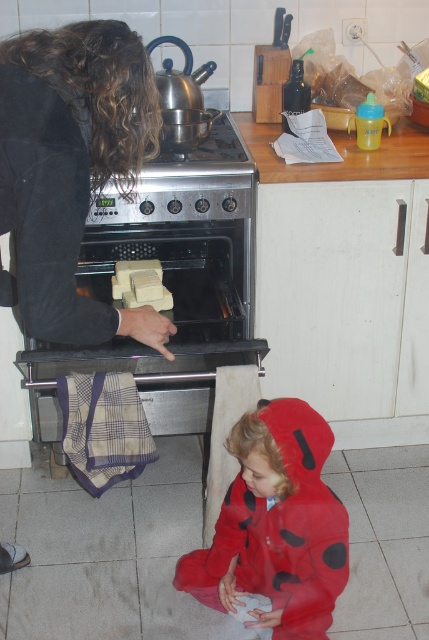
You are a delivery robot with a height of 1.5 meters. You need to deliver a package to the stainless steel oven at center. The package is 1.6 meters tall. Will the package fit inside the oven?

The stainless steel oven at center and viewer are 1.81 meters apart. The height of the package is 1.6 meters, which is less than the distance between the oven and the viewer. Therefore, the package will fit inside the oven.

You are a home chef preparing a meal and need to check the height of the red fuzzy coat at lower center and the yellow soft cheese at oven center. Which object is taller?

The red fuzzy coat at lower center is taller than the yellow soft cheese at oven center according to the description.